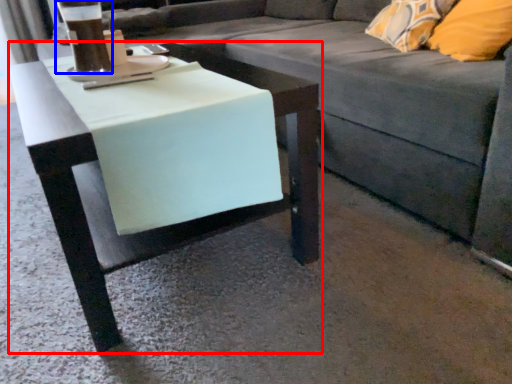
Question: Which object is closer to the camera taking this photo, table (highlighted by a red box) or beverage (highlighted by a blue box)?

Choices:
 (A) table
 (B) beverage

Answer: (A)